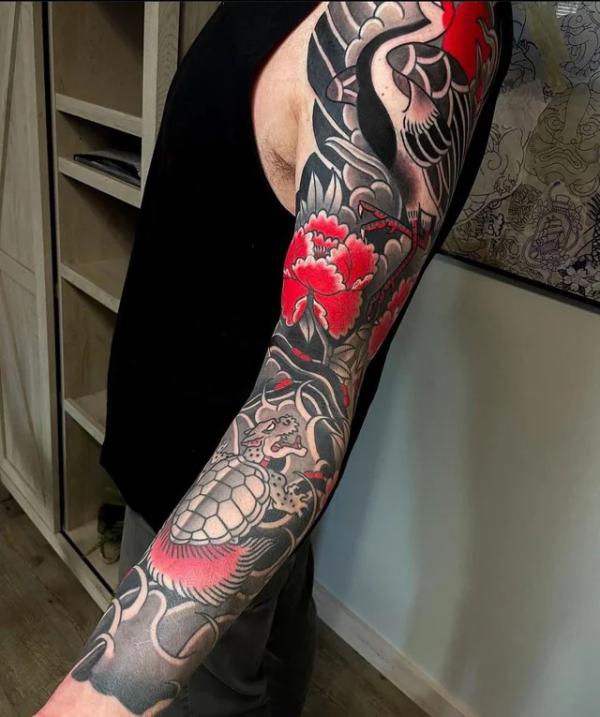
I want to click on white wall, so click(x=489, y=480).